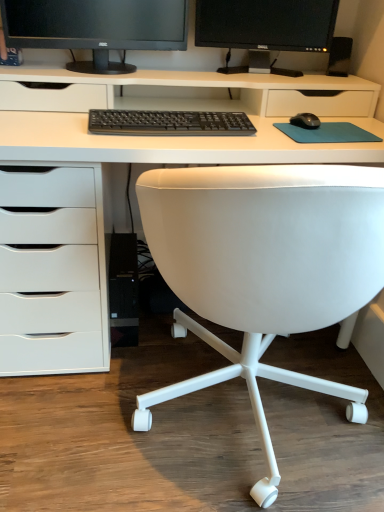
Describe the element at coordinates (264, 268) in the screenshot. I see `white leather chair at center` at that location.

Find the location of a particular element. white matte desk at center is located at coordinates (182, 109).

From the image's perspective, is black glossy monitor at upper center, which appears as the 2th computer monitor when viewed from the left, on top of white matte desk at center?

Indeed, from the image's perspective, black glossy monitor at upper center, which appears as the 2th computer monitor when viewed from the left, is shown above white matte desk at center.

Considering the points (304, 37) and (223, 93), which point is in front, point (304, 37) or point (223, 93)?

The point (304, 37) is in front.

Considering the relative sizes of black glossy monitor at upper center, the 1th computer monitor in the right-to-left sequence, and white matte desk at center in the image provided, is black glossy monitor at upper center, the 1th computer monitor in the right-to-left sequence, wider than white matte desk at center?

No.

Which is more to the left, black glossy monitor at upper center, which appears as the 2th computer monitor when viewed from the left, or white matte desk at center?

white matte desk at center is more to the left.

Is black glossy monitor at upper center, which appears as the 2th computer monitor when viewed from the left, a part of black matte monitor at upper center, the 1th computer monitor when ordered from left to right?

No.

Does black matte monitor at upper center, the 1th computer monitor when ordered from left to right, have a lesser width compared to black glossy monitor at upper center, the 1th computer monitor in the right-to-left sequence?

In fact, black matte monitor at upper center, the 1th computer monitor when ordered from left to right, might be wider than black glossy monitor at upper center, the 1th computer monitor in the right-to-left sequence.

From the image's perspective, relative to black glossy monitor at upper center, which appears as the 2th computer monitor when viewed from the left, is black matte monitor at upper center, arranged as the second computer monitor when viewed from the right, above or below?

From the image's perspective, black matte monitor at upper center, arranged as the second computer monitor when viewed from the right, appears below black glossy monitor at upper center, which appears as the 2th computer monitor when viewed from the left.

Is black matte monitor at upper center, arranged as the second computer monitor when viewed from the right, directly adjacent to white leather chair at center?

No, black matte monitor at upper center, arranged as the second computer monitor when viewed from the right, is not with white leather chair at center.

The height and width of the screenshot is (512, 384). I want to click on the 1st computer monitor behind the white leather chair at center, so click(96, 28).

Between point (104, 22) and point (245, 244), which one is positioned in front?

The point (245, 244) is closer.

From the image's perspective, between black matte monitor at upper center, arranged as the second computer monitor when viewed from the right, and white leather chair at center, who is located below?

white leather chair at center appears lower in the image.

Is the position of black plastic speaker at upper right more distant than that of teal fabric mousepad at center?

Yes, the depth of black plastic speaker at upper right is greater than that of teal fabric mousepad at center.

From a real-world perspective, who is located higher, black plastic speaker at upper right or teal fabric mousepad at center?

black plastic speaker at upper right.

From the image's perspective, is black plastic speaker at upper right below teal fabric mousepad at center?

Actually, black plastic speaker at upper right appears above teal fabric mousepad at center in the image.

Is point (340, 64) farther from viewer compared to point (345, 136)?

Yes, point (340, 64) is behind point (345, 136).

Does black plastic speaker at upper right have a lesser width compared to black matte monitor at upper center, arranged as the second computer monitor when viewed from the right?

Yes, black plastic speaker at upper right is thinner than black matte monitor at upper center, arranged as the second computer monitor when viewed from the right.

Is black plastic speaker at upper right positioned before black matte monitor at upper center, the 1th computer monitor when ordered from left to right?

No.

Is black plastic speaker at upper right bigger than black matte monitor at upper center, the 1th computer monitor when ordered from left to right?

Actually, black plastic speaker at upper right might be smaller than black matte monitor at upper center, the 1th computer monitor when ordered from left to right.

Can you confirm if black plastic keyboard at center is smaller than black glossy monitor at upper center, the 1th computer monitor in the right-to-left sequence?

Indeed, black plastic keyboard at center has a smaller size compared to black glossy monitor at upper center, the 1th computer monitor in the right-to-left sequence.

Find the location of a particular element. This screenshot has height=512, width=384. computer monitor on the right of the black plastic keyboard at center is located at coordinates (265, 29).

Between black plastic keyboard at center and black glossy monitor at upper center, the 1th computer monitor in the right-to-left sequence, which one has more height?

black glossy monitor at upper center, the 1th computer monitor in the right-to-left sequence, is taller.

Between black plastic keyboard at center and black glossy monitor at upper center, the 1th computer monitor in the right-to-left sequence, which one has larger width?

black plastic keyboard at center is wider.

From the image's perspective, is black plastic keyboard at center located beneath white leather chair at center?

No, from the image's perspective, black plastic keyboard at center is not beneath white leather chair at center.

Is black plastic keyboard at center shorter than white leather chair at center?

Correct, black plastic keyboard at center is not as tall as white leather chair at center.

Considering the positions of objects black plastic keyboard at center and white leather chair at center in the image provided, who is more to the left, black plastic keyboard at center or white leather chair at center?

black plastic keyboard at center is more to the left.

What's the angular difference between black plastic keyboard at center and white leather chair at center's facing directions?

black plastic keyboard at center and white leather chair at center are facing 180 degrees away from each other.

This screenshot has width=384, height=512. I want to click on the 2nd computer monitor behind the white matte desk at center, so click(265, 29).

Image resolution: width=384 pixels, height=512 pixels. I want to click on computer monitor above the black matte monitor at upper center, the 1th computer monitor when ordered from left to right (from a real-world perspective), so click(265, 29).

Estimate the real-world distances between objects in this image. Which object is closer to black glossy monitor at upper center, the 1th computer monitor in the right-to-left sequence, white leather chair at center or black plastic keyboard at center?

black plastic keyboard at center lies closer to black glossy monitor at upper center, the 1th computer monitor in the right-to-left sequence, than the other object.

Estimate the real-world distances between objects in this image. Which object is further from black plastic speaker at upper right, black matte monitor at upper center, the 1th computer monitor when ordered from left to right, or black glossy monitor at upper center, the 1th computer monitor in the right-to-left sequence?

Based on the image, black matte monitor at upper center, the 1th computer monitor when ordered from left to right, appears to be further to black plastic speaker at upper right.

Estimate the real-world distances between objects in this image. Which object is further from black plastic speaker at upper right, black matte mouse at right or teal fabric mousepad at center?

teal fabric mousepad at center.

When comparing their distances from black matte monitor at upper center, the 1th computer monitor when ordered from left to right, does black plastic speaker at upper right or white leather chair at center seem further?

Among the two, white leather chair at center is located further to black matte monitor at upper center, the 1th computer monitor when ordered from left to right.

When comparing their distances from black glossy monitor at upper center, the 1th computer monitor in the right-to-left sequence, does black plastic speaker at upper right or teal fabric mousepad at center seem further?

teal fabric mousepad at center.

Based on their spatial positions, is white leather chair at center or black plastic keyboard at center further from black matte mouse at right?

Based on the image, white leather chair at center appears to be further to black matte mouse at right.

Looking at the image, which one is located further to black glossy monitor at upper center, the 1th computer monitor in the right-to-left sequence, black plastic keyboard at center or teal fabric mousepad at center?

black plastic keyboard at center.

Which object lies further to the anchor point black glossy monitor at upper center, which appears as the 2th computer monitor when viewed from the left, black matte monitor at upper center, the 1th computer monitor when ordered from left to right, or black plastic keyboard at center?

Based on the image, black plastic keyboard at center appears to be further to black glossy monitor at upper center, which appears as the 2th computer monitor when viewed from the left.

Where is `desk between black glossy monitor at upper center, which appears as the 2th computer monitor when viewed from the left, and white leather chair at center from top to bottom`? The image size is (384, 512). desk between black glossy monitor at upper center, which appears as the 2th computer monitor when viewed from the left, and white leather chair at center from top to bottom is located at coordinates (182, 109).

At what (x,y) coordinates should I click in order to perform the action: click on computer keyboard between black glossy monitor at upper center, the 1th computer monitor in the right-to-left sequence, and white leather chair at center in the up-down direction. Please return your answer as a coordinate pair (x, y). Looking at the image, I should click on (169, 123).

You are a GUI agent. You are given a task and a screenshot of the screen. Output one action in this format:
    pyautogui.click(x=<x>, y=<y>)
    Task: Click on the computer keyboard between white leather chair at center and black matte mouse at right along the z-axis
    
    Given the screenshot: What is the action you would take?
    pyautogui.click(x=169, y=123)

The width and height of the screenshot is (384, 512). I want to click on mousepad between black matte monitor at upper center, arranged as the second computer monitor when viewed from the right, and white leather chair at center vertically, so point(326,132).